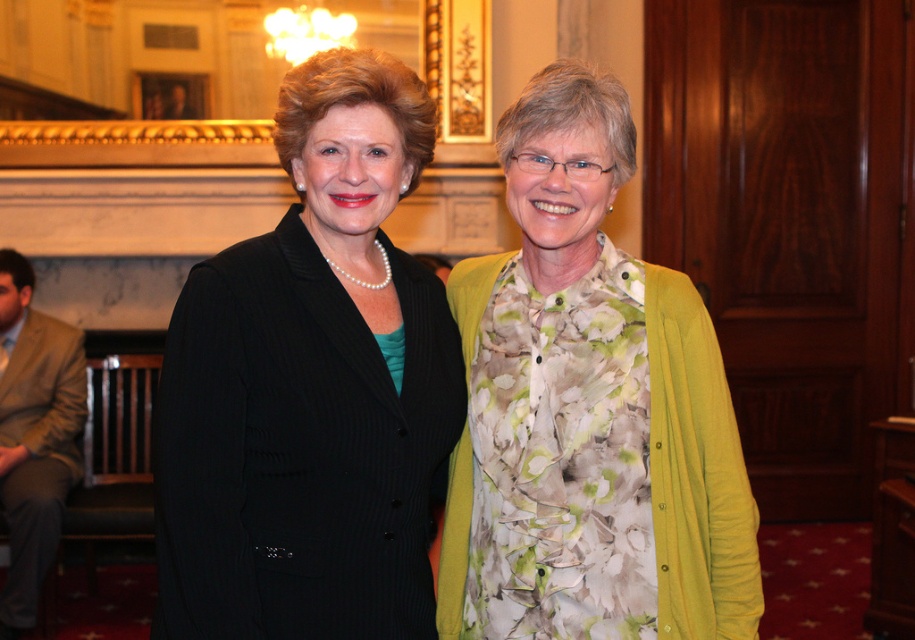
Question: Is black textured blazer at center positioned behind floral fabric dress at center?

Choices:
 (A) no
 (B) yes

Answer: (A)

Question: Which point is farther from the camera taking this photo?

Choices:
 (A) (162, 582)
 (B) (38, 426)

Answer: (B)

Question: Is black textured blazer at center wider than tan fabric suit at left?

Choices:
 (A) no
 (B) yes

Answer: (B)

Question: Can you confirm if black textured blazer at center is smaller than tan fabric suit at left?

Choices:
 (A) no
 (B) yes

Answer: (B)

Question: Which is farther from the floral fabric dress at center?

Choices:
 (A) black textured blazer at center
 (B) tan fabric suit at left

Answer: (B)

Question: Which point appears closest to the camera in this image?

Choices:
 (A) (425, 545)
 (B) (512, 296)

Answer: (A)